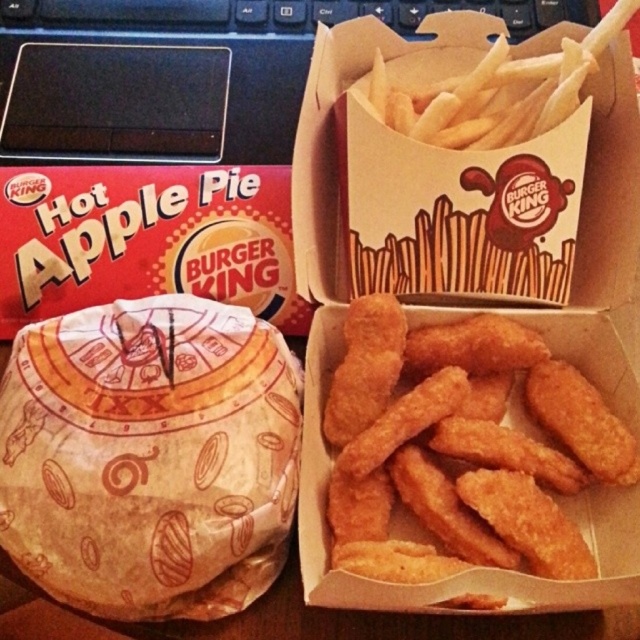
You are at Burger King and want to know which food item is bigger between the golden crispy nuggets at center and the golden crispy french fries at upper center. Which one is larger?

The golden crispy nuggets at center are larger in size compared to the golden crispy french fries at upper center.

You are a customer at Burger King looking at the wooden surface where the meal is placed. There are two points marked on the surface at coordinates point (236,12) and point (628,4). If you were to walk towards the wooden surface, which point would you reach first?

Point (236,12) is further to the viewer than point (628,4), so you would reach point (236,12) first as it is closer to your starting position.